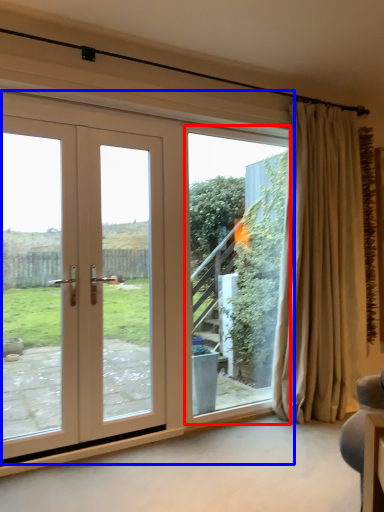
Question: Among these objects, which one is nearest to the camera, window screen (highlighted by a red box) or door (highlighted by a blue box)?

Choices:
 (A) window screen
 (B) door

Answer: (B)